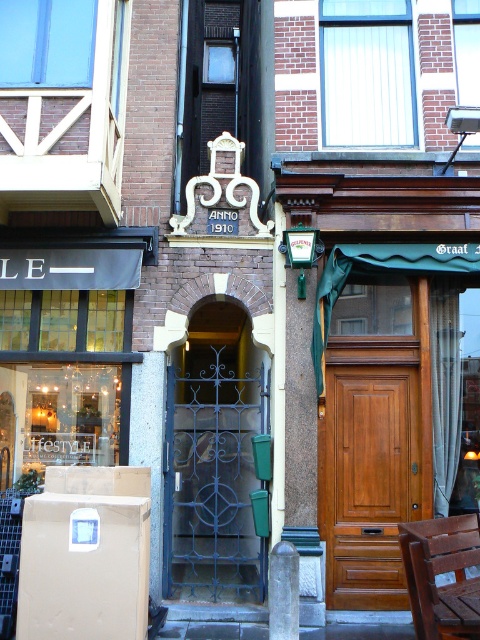
Question: Does wooden door at center appear under brown wooden table at lower right?

Choices:
 (A) yes
 (B) no

Answer: (B)

Question: Does wrought iron gate at center have a greater width compared to brown wooden chair at lower right?

Choices:
 (A) no
 (B) yes

Answer: (B)

Question: Can you confirm if wrought iron gate at center is positioned below brown wooden chair at lower right?

Choices:
 (A) no
 (B) yes

Answer: (A)

Question: Which of these objects is positioned farthest from the wooden door at center?

Choices:
 (A) wrought iron gate at center
 (B) brown wooden table at lower right
 (C) brown wooden chair at lower right

Answer: (B)

Question: Which point is closer to the camera taking this photo?

Choices:
 (A) (261, 593)
 (B) (475, 634)
 (C) (447, 612)
 (D) (369, 563)

Answer: (B)

Question: Which object is the farthest from the wooden door at center?

Choices:
 (A) brown wooden table at lower right
 (B) wrought iron gate at center

Answer: (A)